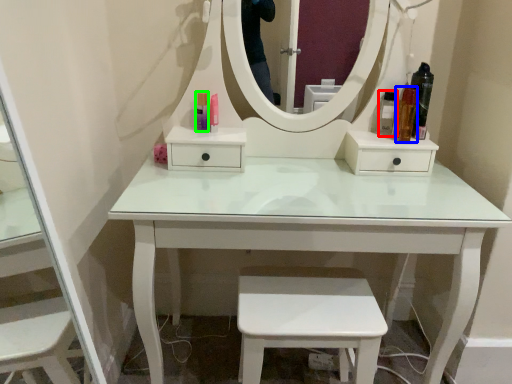
Question: Considering the real-world distances, which object is farthest from toiletry (highlighted by a red box)? toiletry (highlighted by a blue box) or toiletry (highlighted by a green box)?

Choices:
 (A) toiletry
 (B) toiletry

Answer: (B)